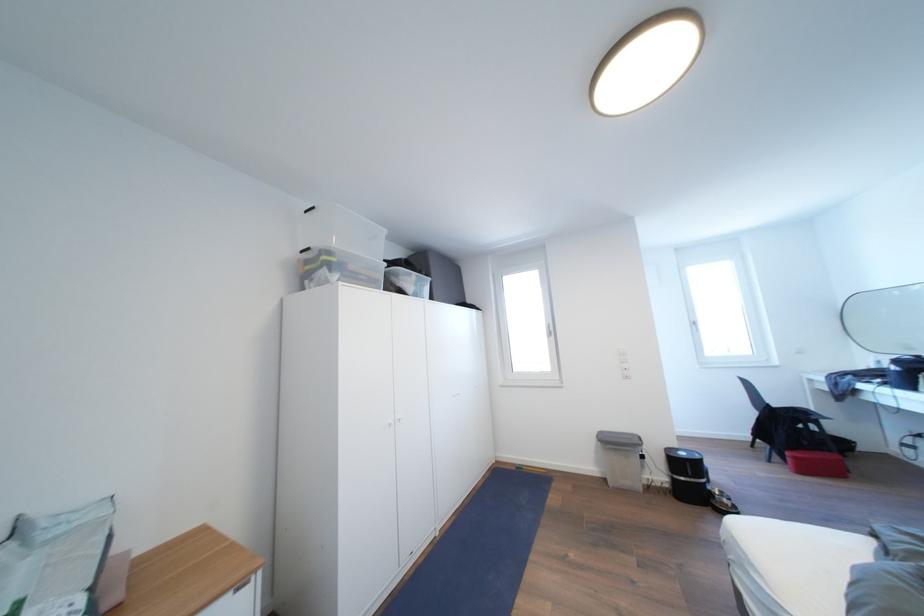
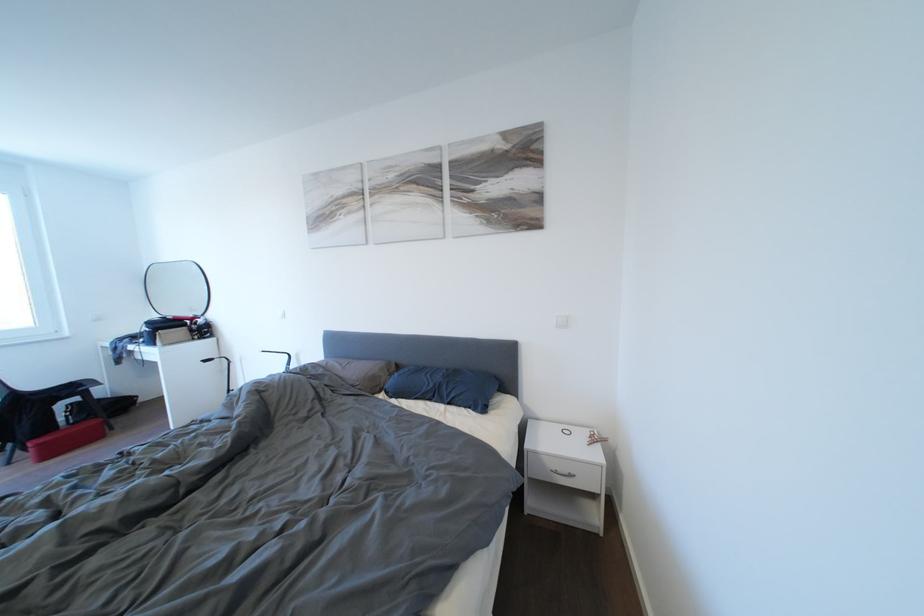
Question: The images are taken continuously from a first-person perspective. In which direction is your viewpoint rotating?

Choices:
 (A) Left
 (B) Right
 (C) Up
 (D) Down

Answer: (B)